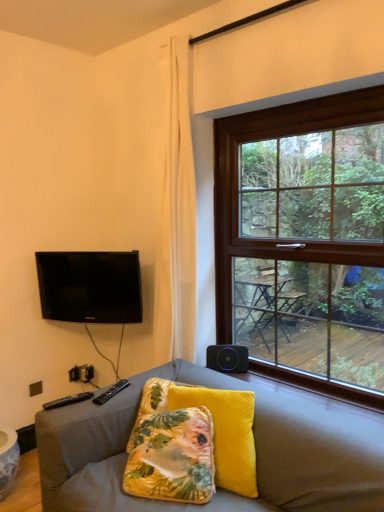
Question: From a real-world perspective, is black glossy tv at upper left positioned above or below velvet floral pillow at center?

Choices:
 (A) above
 (B) below

Answer: (A)

Question: In the image, is black glossy tv at upper left positioned in front of or behind velvet floral pillow at center?

Choices:
 (A) behind
 (B) front

Answer: (A)

Question: Estimate the real-world distances between objects in this image. Which object is closer to the velvet gray couch at lower center?

Choices:
 (A) velvet floral pillow at center
 (B) black plastic remote at lower left
 (C) black matte speaker at lower right
 (D) black glossy tv at upper left
 (E) brown wooden window at upper right

Answer: (A)

Question: Which is farther from the velvet floral pillow at center?

Choices:
 (A) black matte speaker at lower right
 (B) black glossy tv at upper left
 (C) velvet gray couch at lower center
 (D) black plastic remote at lower left
 (E) brown wooden window at upper right

Answer: (E)